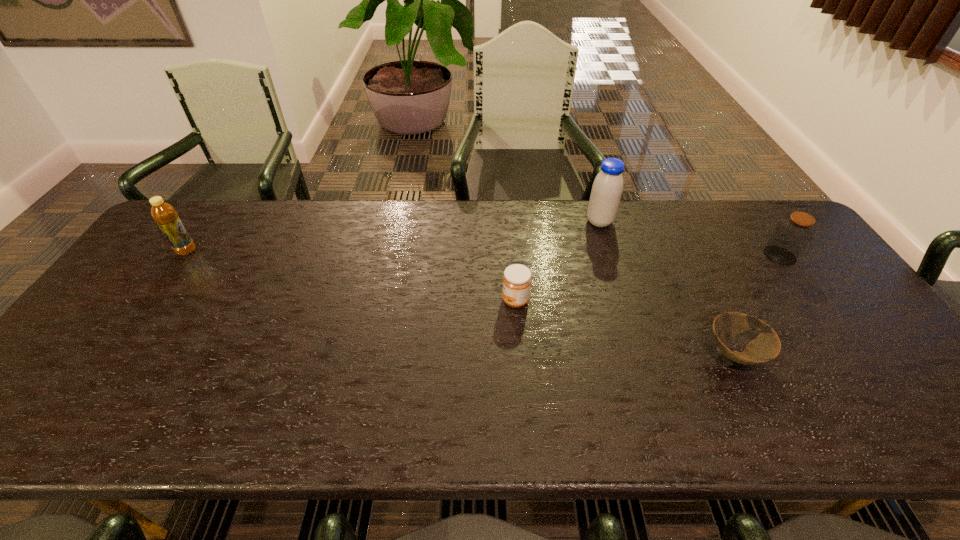
The image size is (960, 540). I want to click on object that is the fourth closest to the leftmost object, so click(x=792, y=235).

This screenshot has width=960, height=540. Find the location of `free location that satisfies the following two spatial constraints: 1. on the front label of the jam; 2. on the right side of the shortest object`. free location that satisfies the following two spatial constraints: 1. on the front label of the jam; 2. on the right side of the shortest object is located at coordinates (519, 354).

This screenshot has width=960, height=540. What are the coordinates of `vacant space that satisfies the following two spatial constraints: 1. on the front side of the nearest object; 2. on the right side of the second tallest object` in the screenshot? It's located at (114, 354).

Where is `vacant region that satisfies the following two spatial constraints: 1. on the front side of the shortest object; 2. on the right side of the bottle`? This screenshot has width=960, height=540. vacant region that satisfies the following two spatial constraints: 1. on the front side of the shortest object; 2. on the right side of the bottle is located at coordinates (114, 354).

At what (x,y) coordinates should I click in order to perform the action: click on free space in the image that satisfies the following two spatial constraints: 1. on the front label of the nearest object; 2. on the right side of the fourth farthest object. Please return your answer as a coordinate pair (x, y). Looking at the image, I should click on (519, 354).

Find the location of `free space in the image that satisfies the following two spatial constraints: 1. on the front side of the soya milk; 2. on the right side of the shortest object`. free space in the image that satisfies the following two spatial constraints: 1. on the front side of the soya milk; 2. on the right side of the shortest object is located at coordinates (640, 354).